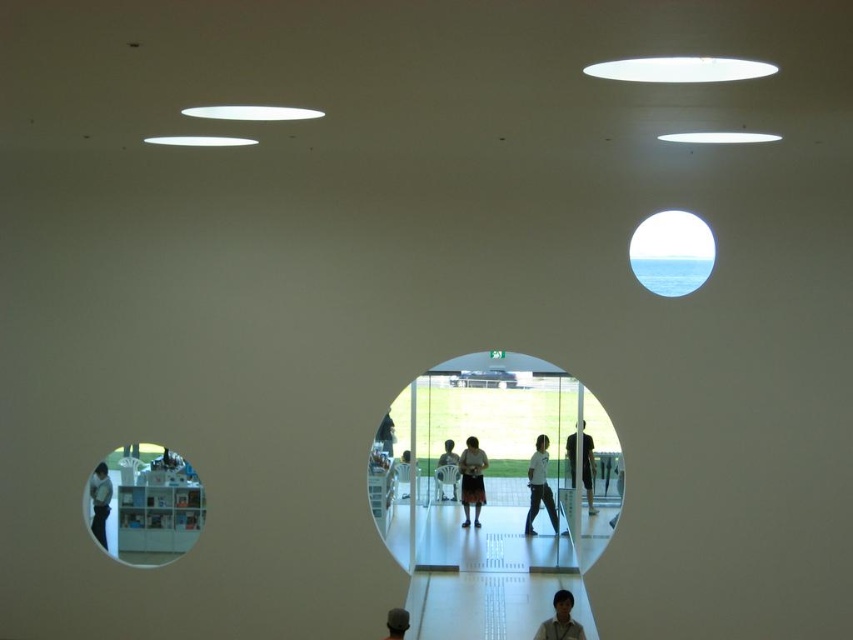
Question: Is the position of clear glass display case at lower left more distant than that of light brown wooden chair at center?

Choices:
 (A) yes
 (B) no

Answer: (B)

Question: Is white matte pants at center closer to camera compared to white plastic chair at center?

Choices:
 (A) no
 (B) yes

Answer: (A)

Question: Which point is closer to the camera?

Choices:
 (A) (695, 218)
 (B) (100, 516)
 (C) (445, 440)
 (D) (467, 444)

Answer: (A)

Question: Which of these objects is positioned closest to the transparent glass window at center?

Choices:
 (A) clear glass display case at lower left
 (B) white plastic chair at center
 (C) light brown wooden chair at center
 (D) light brown hair at lower center

Answer: (B)

Question: Which point appears farthest from the camera in this image?

Choices:
 (A) (99, 544)
 (B) (91, 483)
 (C) (405, 616)

Answer: (B)

Question: Is white shirt at left positioned at the back of white plastic chair at center?

Choices:
 (A) yes
 (B) no

Answer: (B)